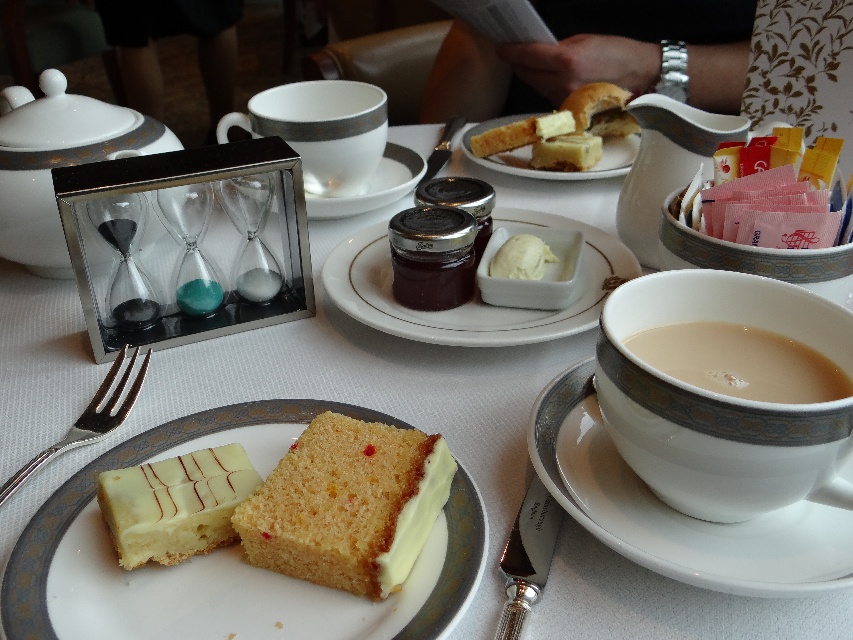
Question: Is yellow sponge cake at center above yellow frosted cake at center?

Choices:
 (A) no
 (B) yes

Answer: (B)

Question: Which object appears closest to the camera in this image?

Choices:
 (A) white ceramic saucer at center
 (B) creamy porcelain cup at right

Answer: (B)

Question: Which of the following is the farthest from the observer?

Choices:
 (A) yellow frosted cake at center
 (B) matte white plate at center
 (C) white glossy cake at center
 (D) matte glass jar at center

Answer: (B)

Question: Is brown matte cup at right to the right of pink paper packets at upper right from the viewer's perspective?

Choices:
 (A) no
 (B) yes

Answer: (A)

Question: Considering the relative positions of white ceramic saucer at right and brown matte cup at right in the image provided, where is white ceramic saucer at right located with respect to brown matte cup at right?

Choices:
 (A) above
 (B) below

Answer: (B)

Question: Which point is closer to the camera taking this photo?

Choices:
 (A) (12, 134)
 (B) (113, 477)
 (C) (772, 157)

Answer: (B)